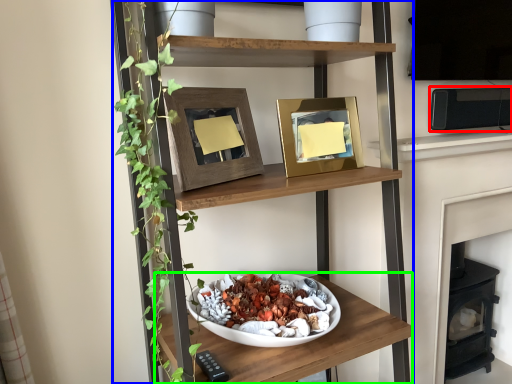
Question: Which is nearer to the appliance (highlighted by a red box)? shelf (highlighted by a blue box) or shelf (highlighted by a green box).

Choices:
 (A) shelf
 (B) shelf

Answer: (A)